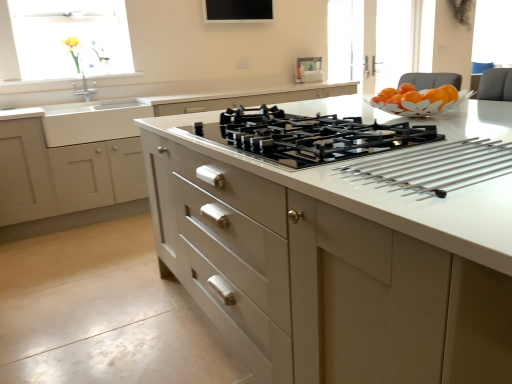
Question: Considering the relative positions of black glass gas stove at center and white glossy countertop at center in the image provided, is black glass gas stove at center to the left of white glossy countertop at center from the viewer's perspective?

Choices:
 (A) no
 (B) yes

Answer: (B)

Question: Is the depth of black glass gas stove at center greater than that of white glossy countertop at center?

Choices:
 (A) yes
 (B) no

Answer: (A)

Question: Considering the relative sizes of black glass gas stove at center and white glossy countertop at center in the image provided, is black glass gas stove at center wider than white glossy countertop at center?

Choices:
 (A) no
 (B) yes

Answer: (A)

Question: From a real-world perspective, does black glass gas stove at center sit lower than white glossy countertop at center?

Choices:
 (A) yes
 (B) no

Answer: (B)

Question: Is black glass gas stove at center completely or partially outside of white glossy countertop at center?

Choices:
 (A) no
 (B) yes

Answer: (A)

Question: From the image's perspective, is white glossy sink at left above or below black glass tv at upper center?

Choices:
 (A) above
 (B) below

Answer: (B)

Question: Choose the correct answer: Is white glossy sink at left inside black glass tv at upper center or outside it?

Choices:
 (A) inside
 (B) outside

Answer: (B)

Question: From their relative heights in the image, would you say white glossy sink at left is taller or shorter than black glass tv at upper center?

Choices:
 (A) tall
 (B) short

Answer: (A)

Question: Does point (92, 137) appear closer or farther from the camera than point (206, 16)?

Choices:
 (A) closer
 (B) farther

Answer: (A)

Question: Choose the correct answer: Is translucent glass window at upper left inside yellow matte flower at upper left or outside it?

Choices:
 (A) outside
 (B) inside

Answer: (A)

Question: From their relative heights in the image, would you say translucent glass window at upper left is taller or shorter than yellow matte flower at upper left?

Choices:
 (A) short
 (B) tall

Answer: (B)

Question: From a real-world perspective, is translucent glass window at upper left above or below yellow matte flower at upper left?

Choices:
 (A) below
 (B) above

Answer: (B)

Question: Relative to yellow matte flower at upper left, is translucent glass window at upper left in front or behind?

Choices:
 (A) front
 (B) behind

Answer: (A)

Question: Based on their positions, is translucent glass window at upper left located to the left or right of white glossy sink at left?

Choices:
 (A) right
 (B) left

Answer: (B)

Question: Choose the correct answer: Is translucent glass window at upper left inside white glossy sink at left or outside it?

Choices:
 (A) outside
 (B) inside

Answer: (A)